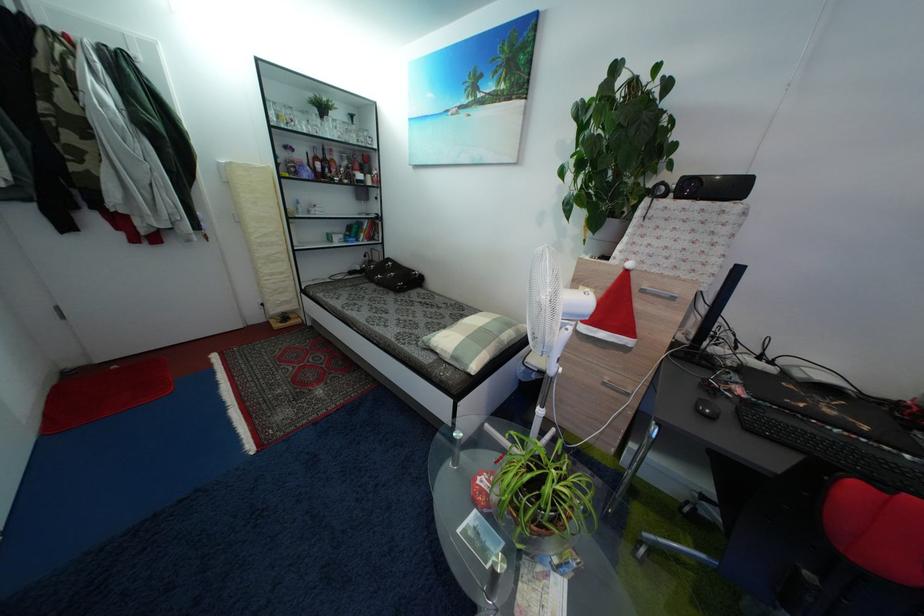
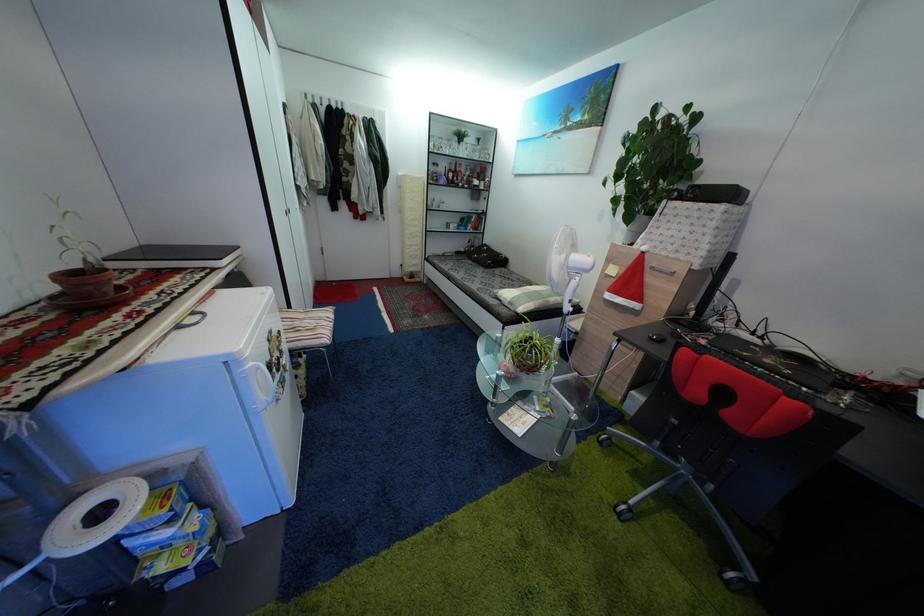
Find the pixel in the second image that matches (x=646, y=291) in the first image.

(659, 270)